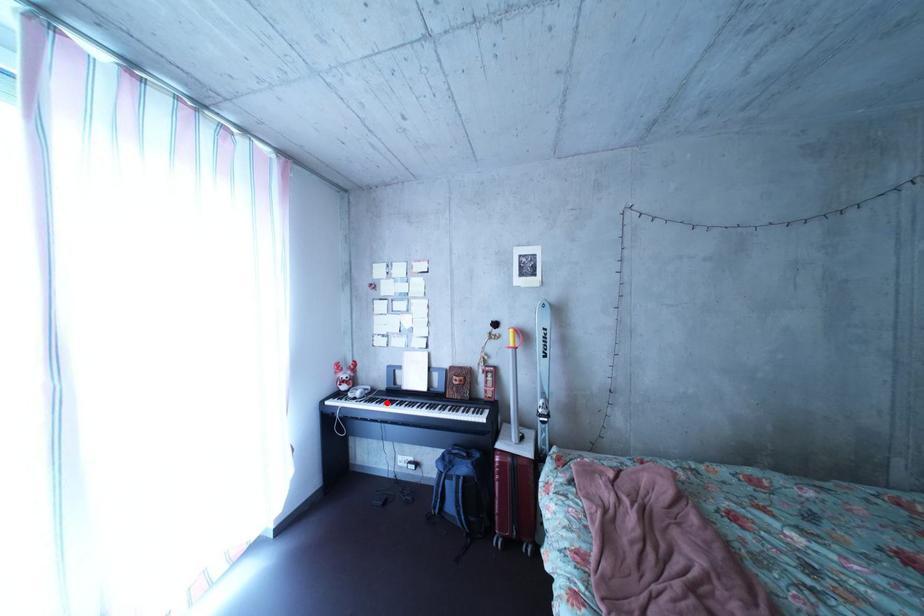
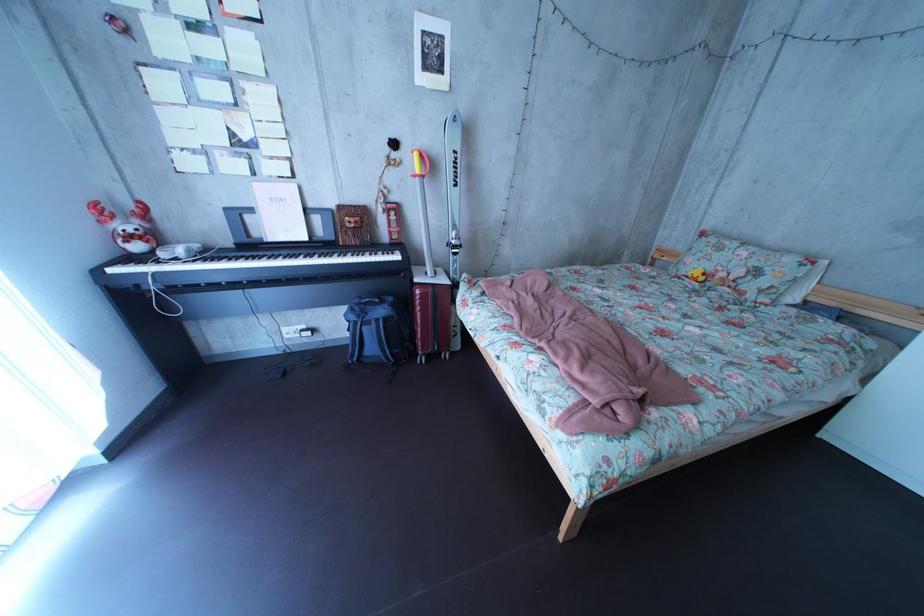
Locate, in the second image, the point that corresponds to the highlighted location in the first image.

(225, 262)